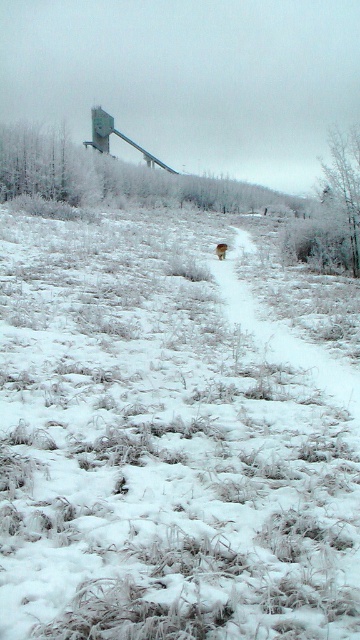
You are standing at the starting point of the path in the winter landscape. You want to place a small red flag exactly where the point labeled as point (159, 449) is located. Is this point on the path or in the snow field?

The point (159, 449) corresponds to white fluffy snow at center, so it is located in the snow field and not on the path.

You are standing at the edge of the snowy field and see the white fluffy snow at center and the brown furry dog at center. Which object is closer to you?

The white fluffy snow at center is closer to the viewer than the brown furry dog at center.